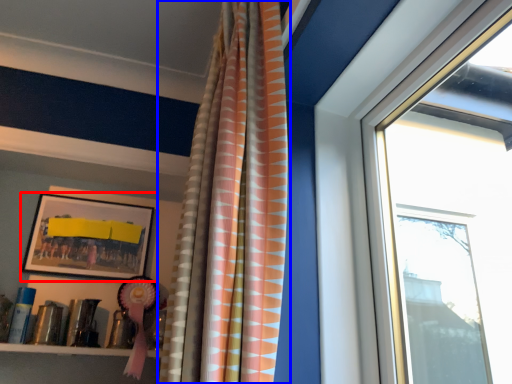
Question: Which object is closer to the camera taking this photo, picture frame (highlighted by a red box) or curtain (highlighted by a blue box)?

Choices:
 (A) picture frame
 (B) curtain

Answer: (B)